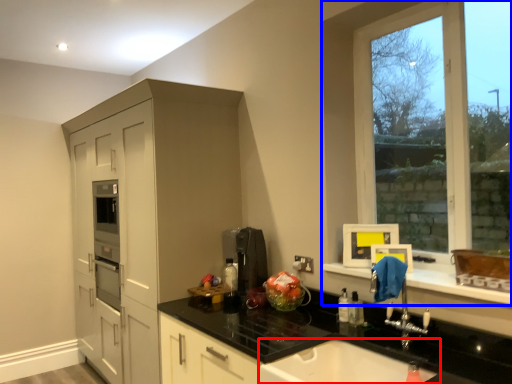
Question: Which object is further to the camera taking this photo, sink (highlighted by a red box) or window (highlighted by a blue box)?

Choices:
 (A) sink
 (B) window

Answer: (B)